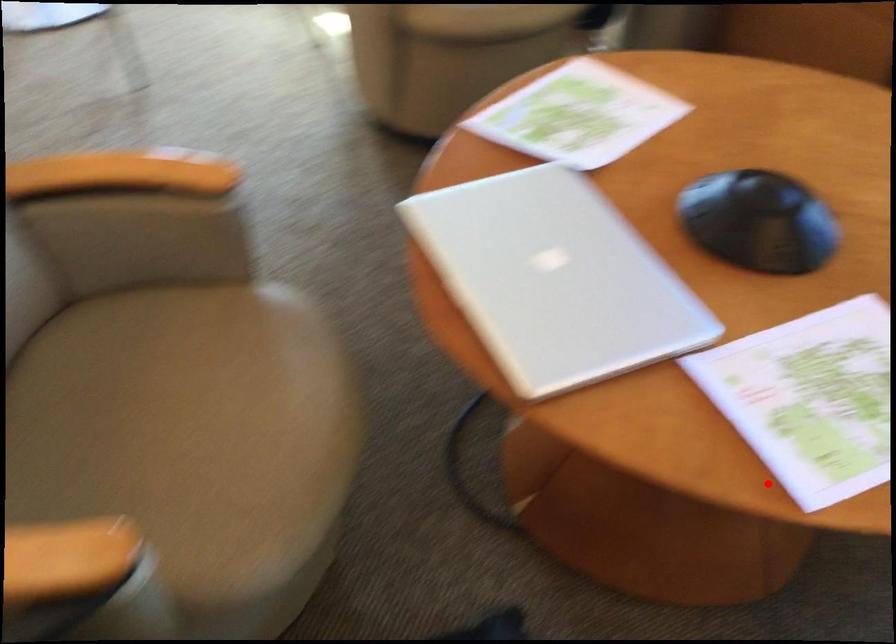
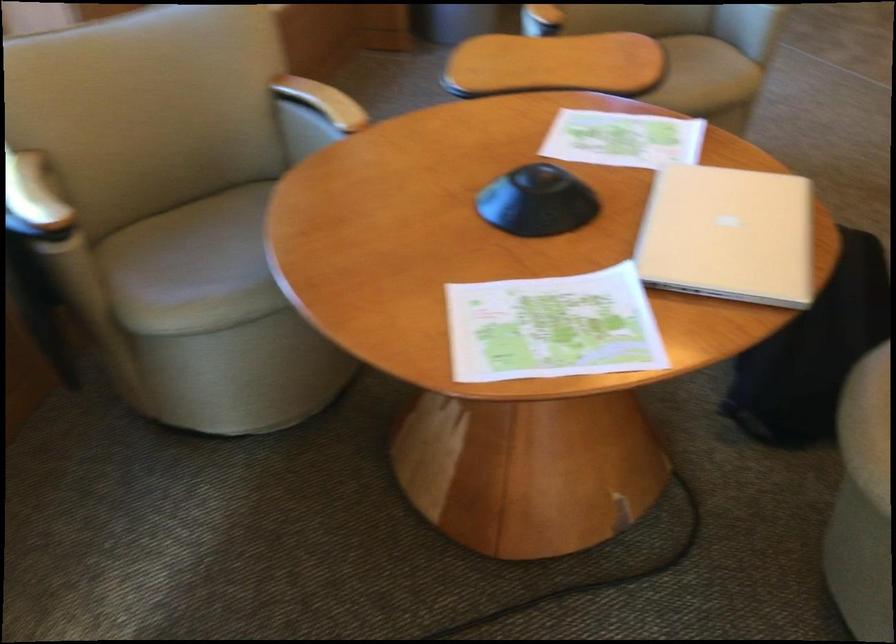
Locate, in the second image, the point that corresponds to the highlighted location in the first image.

(623, 138)